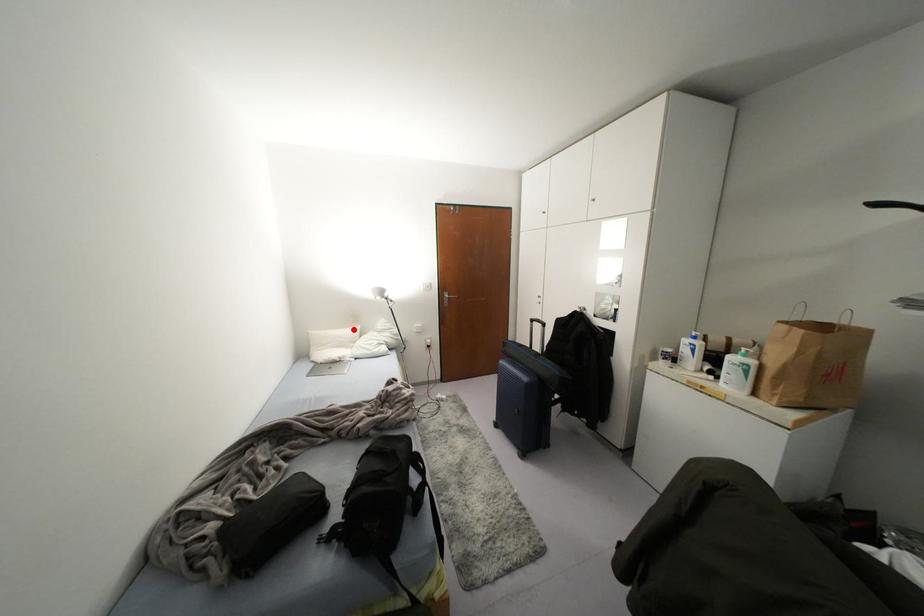
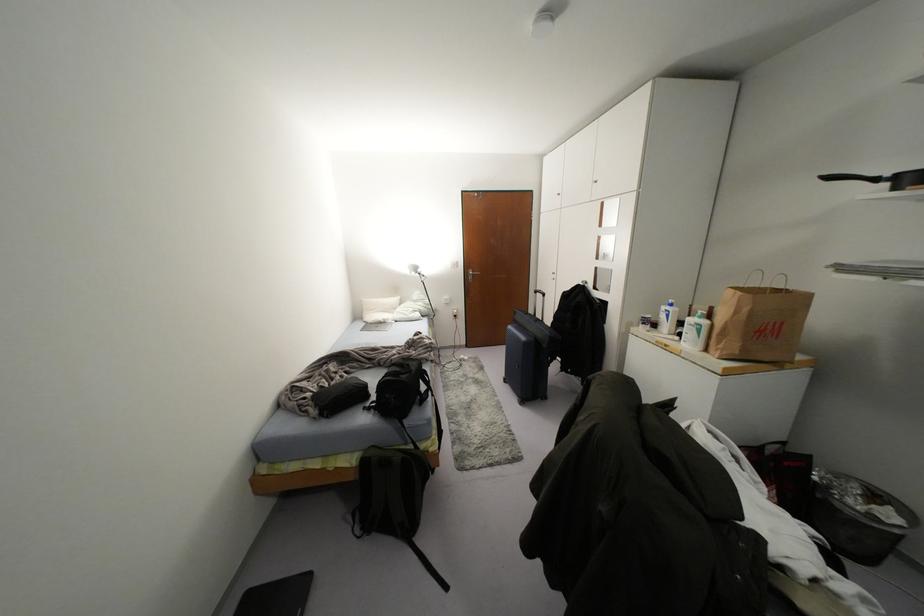
Where in the second image is the point corresponding to the highlighted location from the first image?

(394, 299)